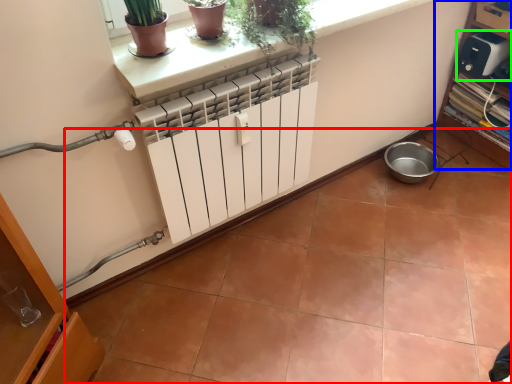
Question: Based on their relative distances, which object is nearer to ceramic tile (highlighted by a red box)? Choose from shelf (highlighted by a blue box) and appliance (highlighted by a green box).

Choices:
 (A) shelf
 (B) appliance

Answer: (A)